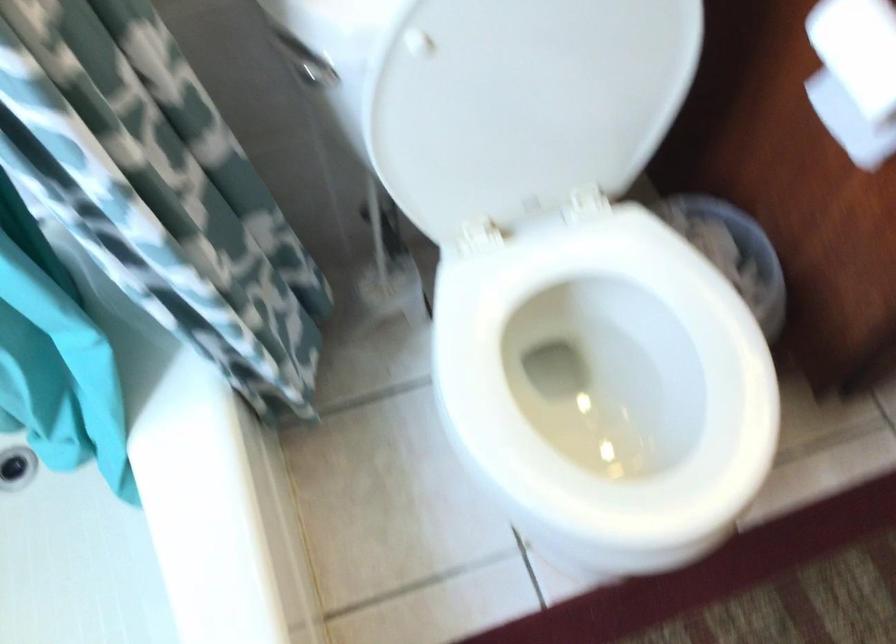
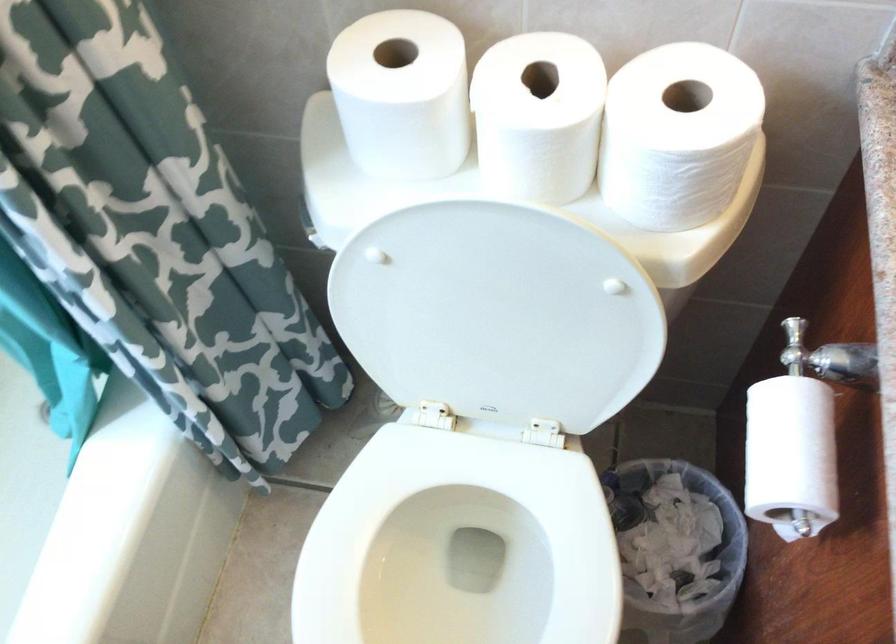
Question: The first image is from the beginning of the video and the second image is from the end. How did the camera likely rotate when shooting the video?

Choices:
 (A) Left
 (B) Right
 (C) Up
 (D) Down

Answer: (A)